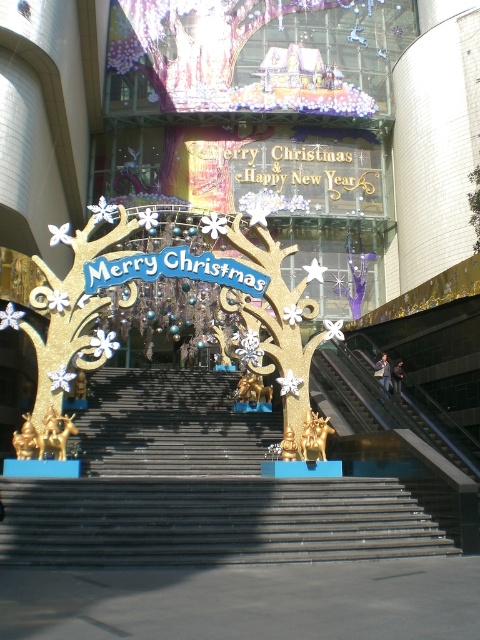
Between point (90, 426) and point (312, 436), which one is positioned in front?

Positioned in front is point (312, 436).

Is black smooth stairs at center to the right of gold glittering tree at center from the viewer's perspective?

Incorrect, black smooth stairs at center is not on the right side of gold glittering tree at center.

Is point (79, 484) closer to viewer compared to point (255, 259)?

Yes.

Where is `black smooth stairs at center`? This screenshot has width=480, height=640. black smooth stairs at center is located at coordinates (196, 488).

Who is taller, black smooth stairs at center or gold glittery tree at center?

gold glittery tree at center

Locate an element on the screen. This screenshot has width=480, height=640. black smooth stairs at center is located at coordinates (196, 488).

Does gold glittery tree at center come behind gold glittering tree at center?

That is False.

Looking at this image, who is more forward, (81, 276) or (280, 392)?

Point (81, 276) is more forward.

At what (x,y) coordinates should I click in order to perform the action: click on gold glittery tree at center. Please return your answer as a coordinate pair (x, y). Image resolution: width=480 pixels, height=640 pixels. Looking at the image, I should click on (64, 324).